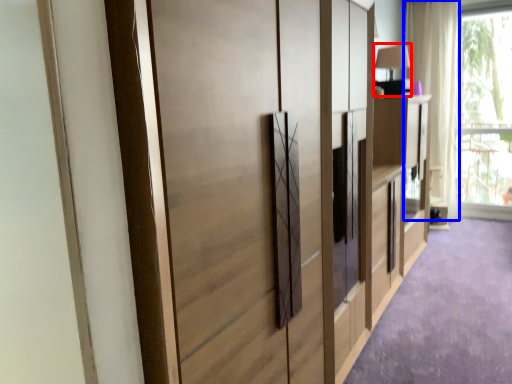
Question: Among these objects, which one is farthest to the camera, table lamp (highlighted by a red box) or curtain (highlighted by a blue box)?

Choices:
 (A) table lamp
 (B) curtain

Answer: (B)